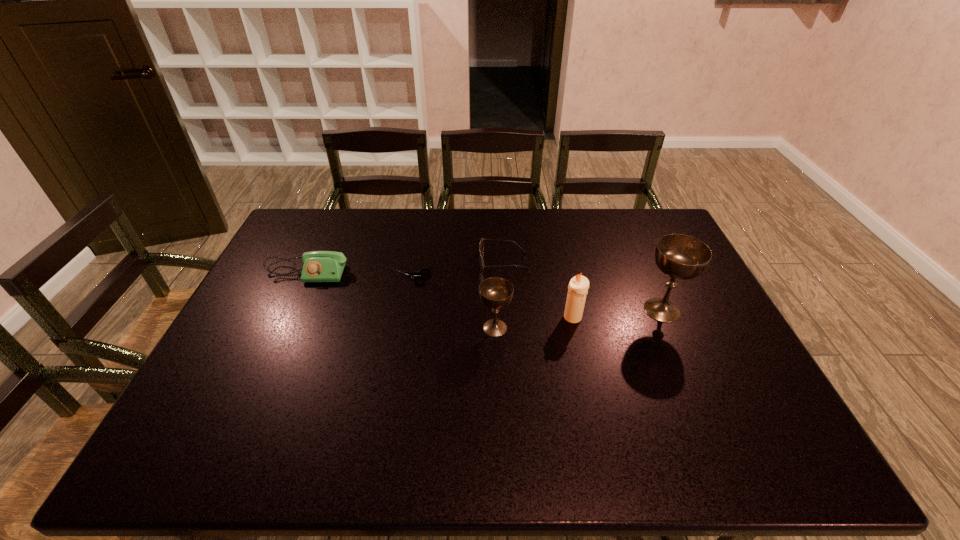
Find the location of a particular element. The width and height of the screenshot is (960, 540). free point between the telephone and the left chalice is located at coordinates (400, 300).

Find the location of a particular element. This screenshot has width=960, height=540. vacant space that's between the fifth object from left to right and the second shortest object is located at coordinates (538, 289).

Find the location of `free space between the taller chalice and the second object from right to left`. free space between the taller chalice and the second object from right to left is located at coordinates (617, 314).

Select which object is the second closest to the shortest object. Please provide its 2D coordinates. Your answer should be formatted as a tuple, i.e. [(x, y)], where the tuple contains the x and y coordinates of a point satisfying the conditions above.

[(319, 266)]

I want to click on object that is the fifth closest one to the leftmost object, so click(x=683, y=257).

You are a GUI agent. You are given a task and a screenshot of the screen. Output one action in this format:
    pyautogui.click(x=<x>, y=<y>)
    Task: Click on the free space that satisfies the following two spatial constraints: 1. on the front side of the rightmost object; 2. on the left side of the second object from left to right
    The image size is (960, 540).
    Given the screenshot: What is the action you would take?
    pyautogui.click(x=407, y=310)

What are the coordinates of `free space that satisfies the following two spatial constraints: 1. on the dial of the shorter chalice; 2. on the right side of the fourth tallest object` in the screenshot? It's located at (281, 328).

Where is `free location that satisfies the following two spatial constraints: 1. on the dial of the fourth tallest object; 2. on the left side of the tallest object`? The image size is (960, 540). free location that satisfies the following two spatial constraints: 1. on the dial of the fourth tallest object; 2. on the left side of the tallest object is located at coordinates (289, 310).

This screenshot has width=960, height=540. In order to click on vacant space that satisfies the following two spatial constraints: 1. on the front side of the shorter chalice; 2. on the left side of the second object from left to right in this screenshot , I will do `click(404, 328)`.

The image size is (960, 540). Find the location of `vacant space that satisfies the following two spatial constraints: 1. on the back side of the candle; 2. on the front-facing side of the sunglasses`. vacant space that satisfies the following two spatial constraints: 1. on the back side of the candle; 2. on the front-facing side of the sunglasses is located at coordinates (561, 261).